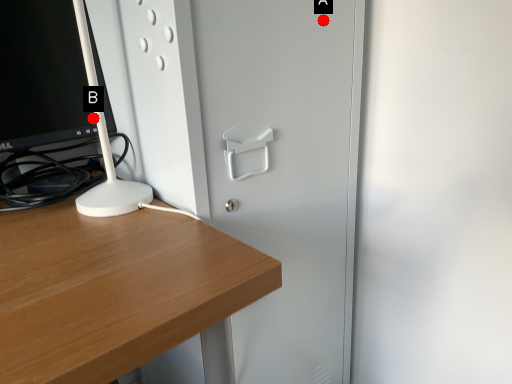
Question: Two points are circled on the image, labeled by A and B beside each circle. Which of the following is the farthest from the observer?

Choices:
 (A) A is further
 (B) B is further

Answer: (B)